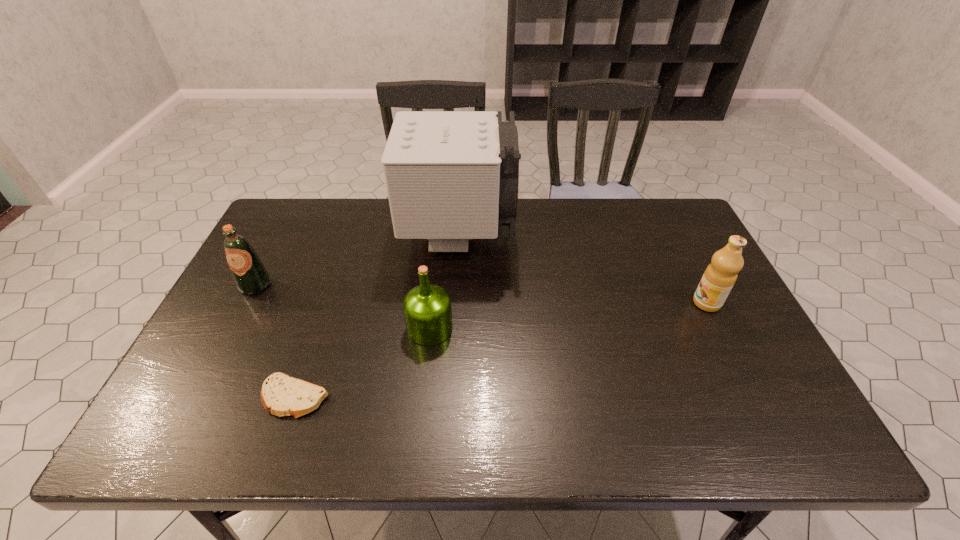
Image resolution: width=960 pixels, height=540 pixels. In order to click on vacant area that lies between the pita bread and the leftmost object in this screenshot , I will do (x=276, y=341).

Where is `vacant area that lies between the second olive oil from right to left and the second object from left to right`? vacant area that lies between the second olive oil from right to left and the second object from left to right is located at coordinates point(362,362).

The width and height of the screenshot is (960, 540). I want to click on blank region between the second olive oil from right to left and the rightmost object, so click(568, 315).

Where is `free spot between the rightmost olive oil and the shortest object`? This screenshot has height=540, width=960. free spot between the rightmost olive oil and the shortest object is located at coordinates (501, 350).

Locate which object ranks third in proximity to the second olive oil from left to right. Please provide its 2D coordinates. Your answer should be formatted as a tuple, i.e. [(x, y)], where the tuple contains the x and y coordinates of a point satisfying the conditions above.

[(251, 277)]

Identify which object is the second closest to the nearest object. Please provide its 2D coordinates. Your answer should be formatted as a tuple, i.e. [(x, y)], where the tuple contains the x and y coordinates of a point satisfying the conditions above.

[(251, 277)]

You are a GUI agent. You are given a task and a screenshot of the screen. Output one action in this format:
    pyautogui.click(x=<x>, y=<y>)
    Task: Click on the olive oil that is the second closest to the fan
    
    Given the screenshot: What is the action you would take?
    pyautogui.click(x=251, y=277)

Locate which olive oil ranks second in proximity to the second object from left to right. Please provide its 2D coordinates. Your answer should be formatted as a tuple, i.e. [(x, y)], where the tuple contains the x and y coordinates of a point satisfying the conditions above.

[(251, 277)]

Find the location of `blank space that satisfies the following two spatial constraints: 1. on the front-facing side of the second object from left to right; 2. on the right side of the leftmost olive oil`. blank space that satisfies the following two spatial constraints: 1. on the front-facing side of the second object from left to right; 2. on the right side of the leftmost olive oil is located at coordinates [198, 397].

At what (x,y) coordinates should I click in order to perform the action: click on vacant space that satisfies the following two spatial constraints: 1. on the label of the rightmost olive oil; 2. on the front side of the shortest object. Please return your answer as a coordinate pair (x, y). The image size is (960, 540). Looking at the image, I should click on (754, 397).